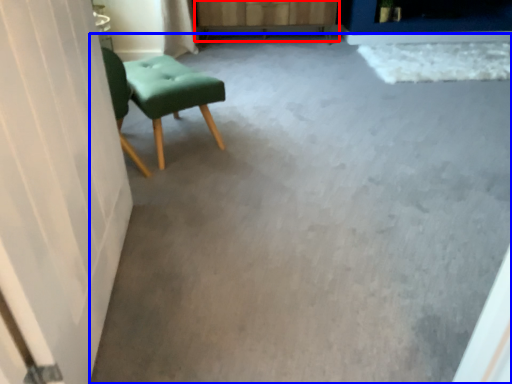
Question: Among these objects, which one is farthest to the camera, dresser (highlighted by a red box) or concrete (highlighted by a blue box)?

Choices:
 (A) dresser
 (B) concrete

Answer: (A)